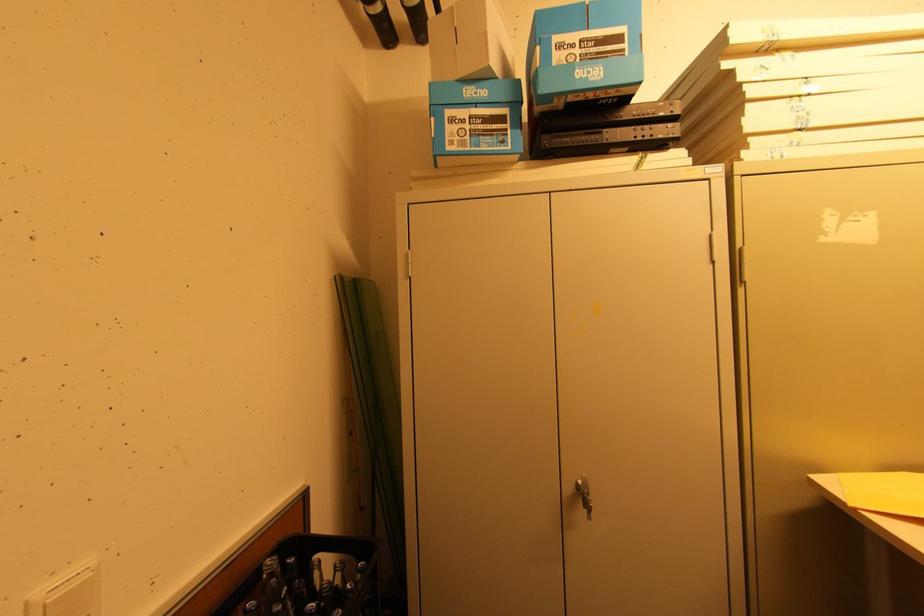
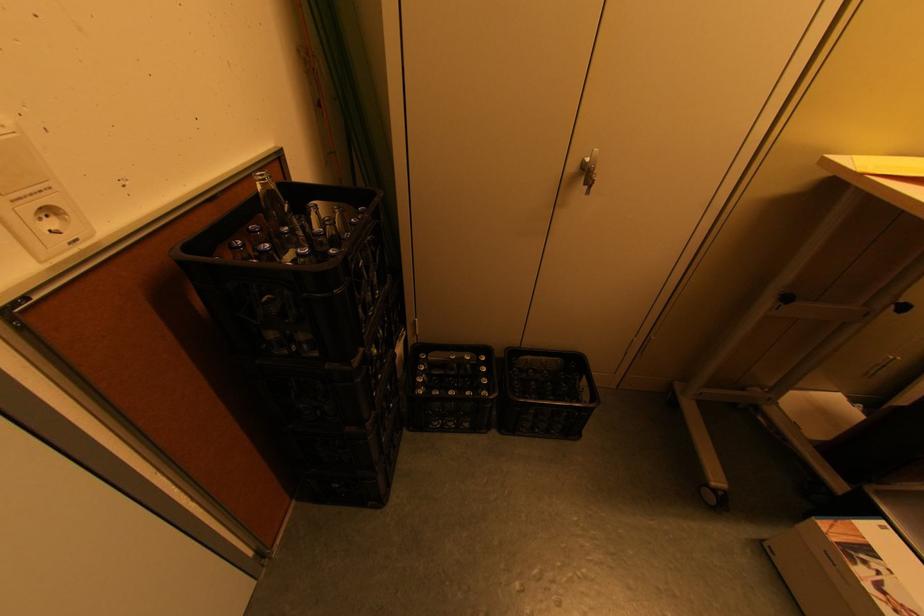
Find the pixel in the second image that matches point 588,508 in the first image.

(588, 185)